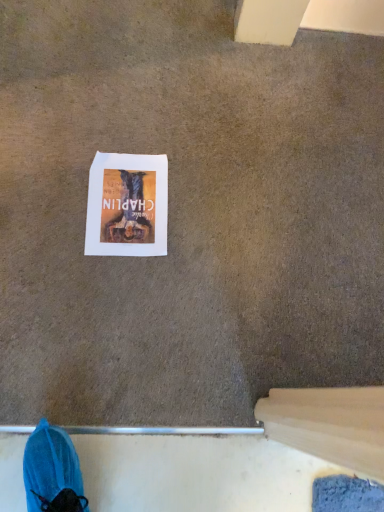
At what (x,y) coordinates should I click in order to perform the action: click on free spot to the left of white paper at center. Please return your answer as a coordinate pair (x, y). The width and height of the screenshot is (384, 512). Looking at the image, I should click on (47, 177).